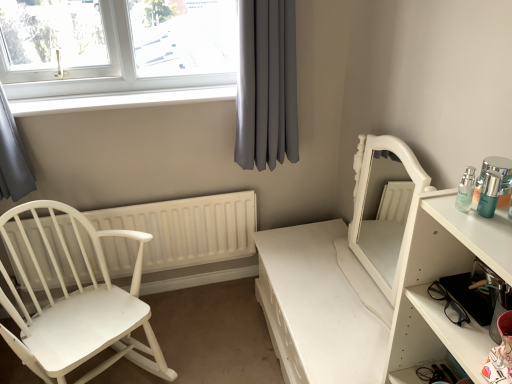
Question: Is gray fabric curtain at upper center wider or thinner than matte glass bottles at right?

Choices:
 (A) thin
 (B) wide

Answer: (B)

Question: Considering the positions of point (248, 79) and point (485, 168), is point (248, 79) closer or farther from the camera than point (485, 168)?

Choices:
 (A) farther
 (B) closer

Answer: (A)

Question: Which object is positioned closest to the white glossy vanity at center right?

Choices:
 (A) matte glass bottles at right
 (B) white glossy window sill at upper left
 (C) gray fabric curtain at upper center
 (D) white wood chair at left
 (E) white plastic window at upper left

Answer: (C)

Question: Which object is the closest to the white glossy mirror at right?

Choices:
 (A) matte glass bottles at right
 (B) white wood chair at left
 (C) white glossy window sill at upper left
 (D) white plastic window at upper left
 (E) white glossy shelf at right

Answer: (E)